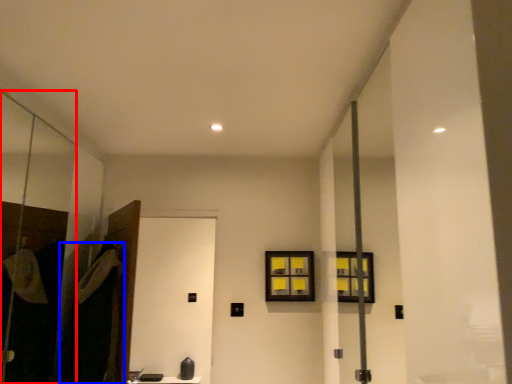
Question: Which object is closer to the camera taking this photo, screen door (highlighted by a red box) or robe (highlighted by a blue box)?

Choices:
 (A) screen door
 (B) robe

Answer: (A)